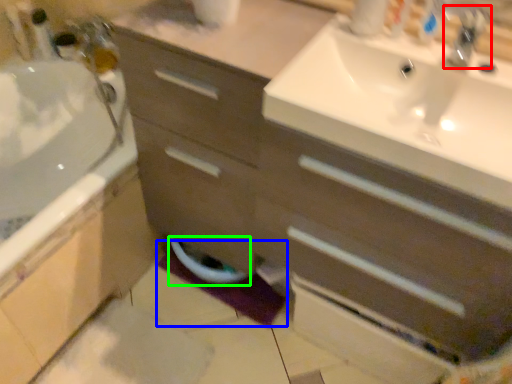
Question: Estimate the real-world distances between objects in this image. Which object is closer to tap (highlighted by a red box), bath mat (highlighted by a blue box) or toilet bowl (highlighted by a green box)?

Choices:
 (A) bath mat
 (B) toilet bowl

Answer: (B)